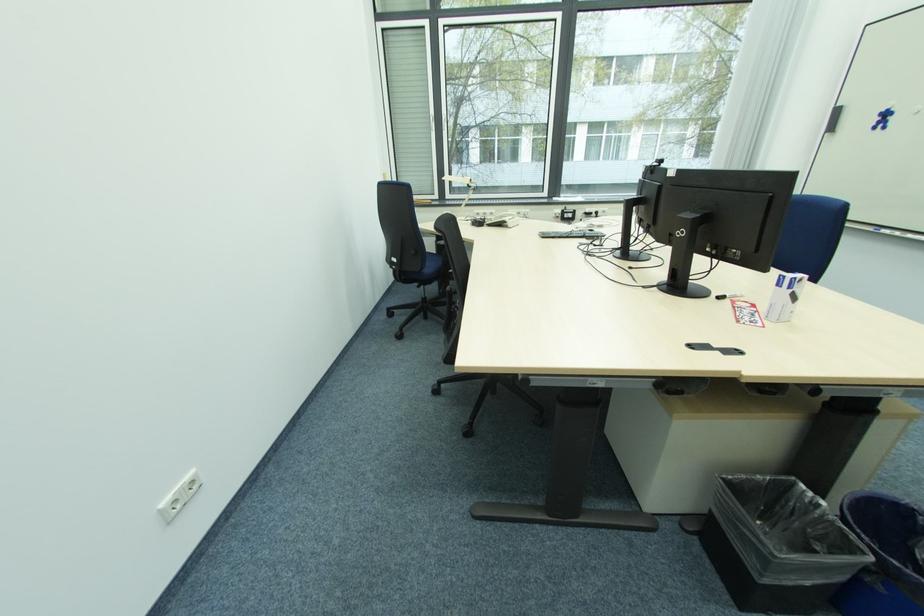
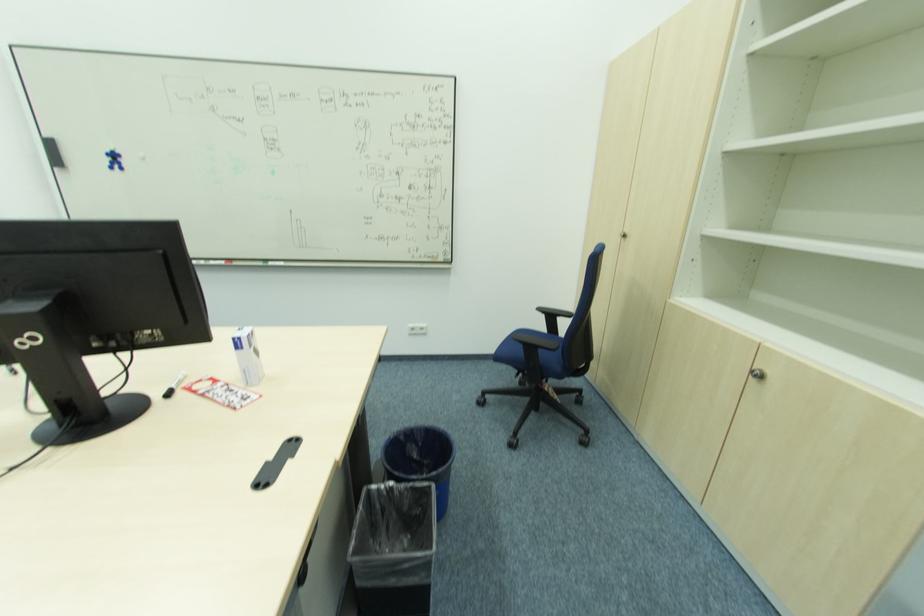
In the second image, find the point that corresponds to (881,121) in the first image.

(116, 161)